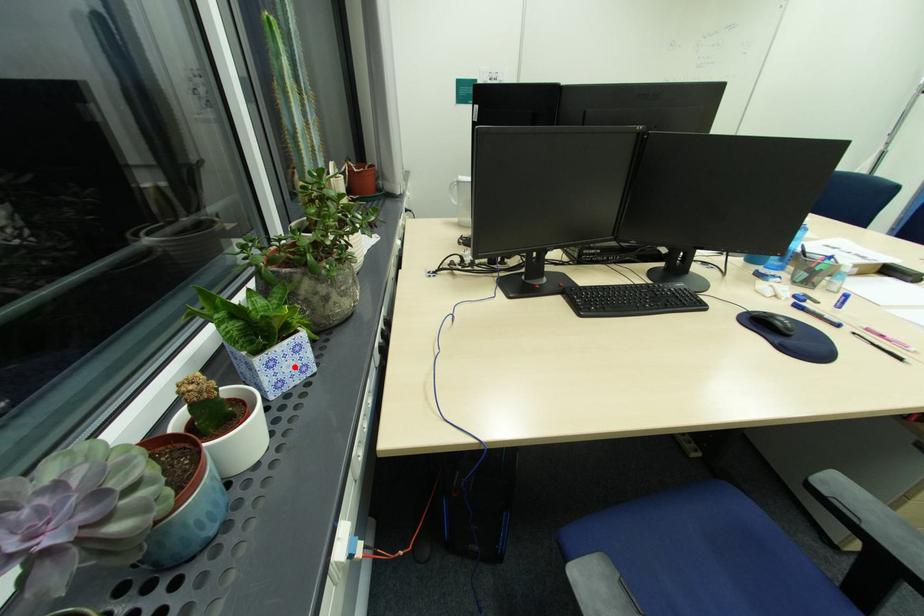
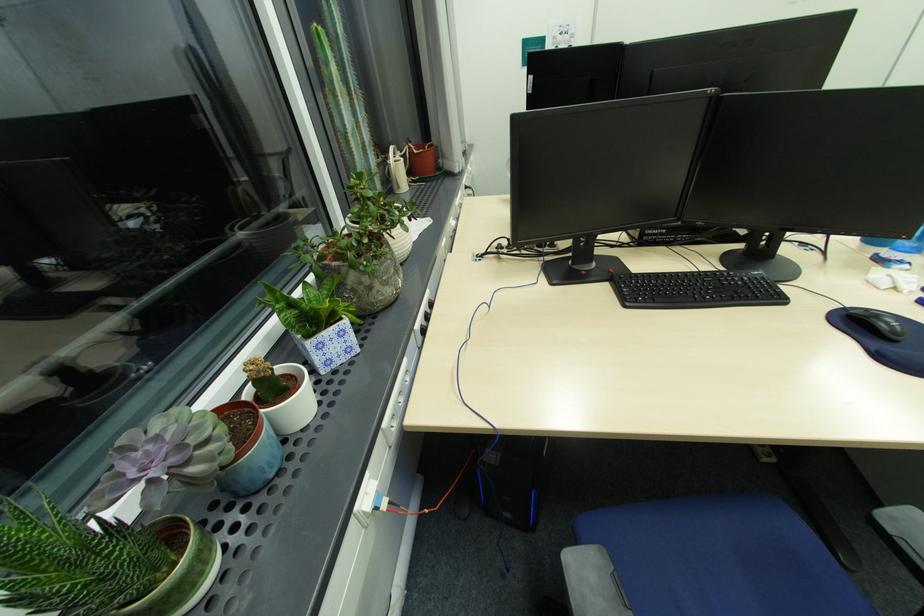
In the second image, find the point that corresponds to the highlighted location in the first image.

(341, 349)